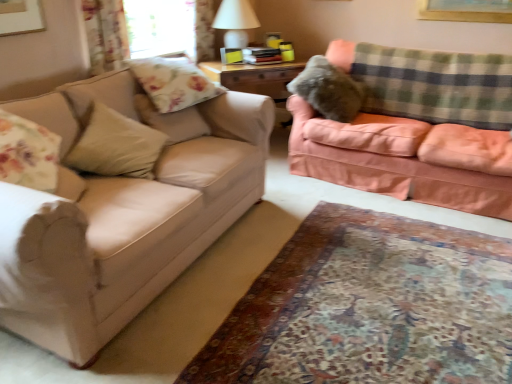
Question: Considering the positions of peach velvety couch at right, the first studio couch when ordered from right to left, and green plaid blanket at upper right in the image, is peach velvety couch at right, the first studio couch when ordered from right to left, wider or thinner than green plaid blanket at upper right?

Choices:
 (A) wide
 (B) thin

Answer: (A)

Question: In the image, is peach velvety couch at right, the second studio couch viewed from the left, on the left side or the right side of green plaid blanket at upper right?

Choices:
 (A) left
 (B) right

Answer: (A)

Question: Estimate the real-world distances between objects in this image. Which object is farther from the carpet at lower center?

Choices:
 (A) matte beige couch at left, the 1th studio couch viewed from the left
 (B) white matte table lamp at upper center
 (C) green plaid blanket at upper right
 (D) transparent glass window screen at upper center
 (E) floral fabric pillow at upper left, positioned as the second pillow in front-to-back order

Answer: (B)

Question: Considering the real-world distances, which object is farthest from the green plaid blanket at upper right?

Choices:
 (A) floral fabric pillow at upper left, marked as the second pillow in a left-to-right arrangement
 (B) peach velvety couch at right, the first studio couch when ordered from right to left
 (C) floral fabric curtain at upper left
 (D) matte beige couch at left, the 1th studio couch viewed from the left
 (E) fuzzy fabric pillow at upper right, the 1th pillow in the right-to-left sequence

Answer: (C)